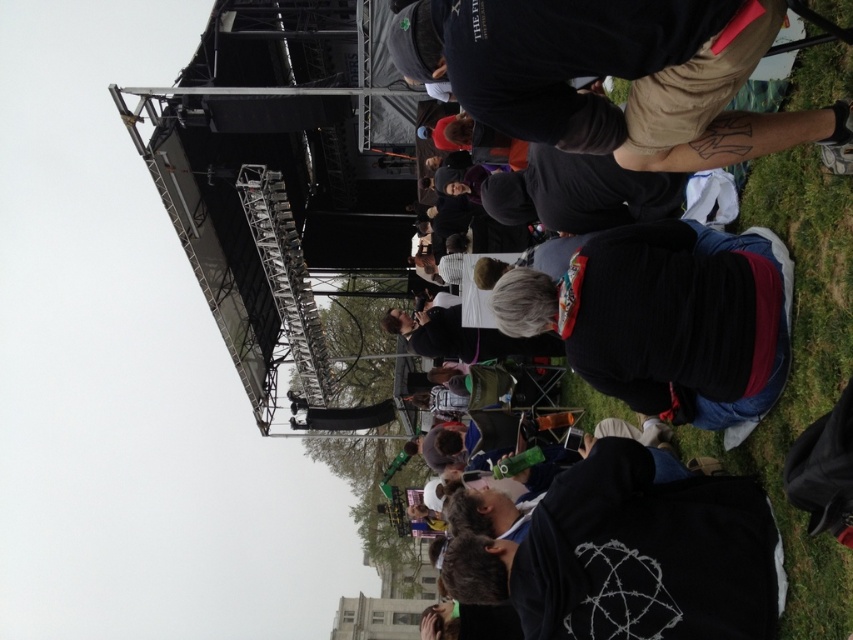
Question: Does black matte jacket at lower right appear under black fabric at center?

Choices:
 (A) no
 (B) yes

Answer: (B)

Question: Considering the real-world distances, which object is farthest from the black fabric at center?

Choices:
 (A) black knit sweater at center
 (B) dark gray t-shirt at upper center

Answer: (A)

Question: Which point appears farthest from the camera in this image?

Choices:
 (A) tap(817, 19)
 (B) tap(708, 112)
 (C) tap(741, 502)
 (D) tap(659, 296)

Answer: (D)

Question: Can you confirm if black matte jacket at lower right is positioned above black knit sweater at center?

Choices:
 (A) yes
 (B) no

Answer: (B)

Question: Which point is closer to the camera taking this photo?

Choices:
 (A) (648, 365)
 (B) (657, 179)

Answer: (A)

Question: Can you confirm if black matte jacket at lower right is bigger than black knit sweater at center?

Choices:
 (A) no
 (B) yes

Answer: (B)